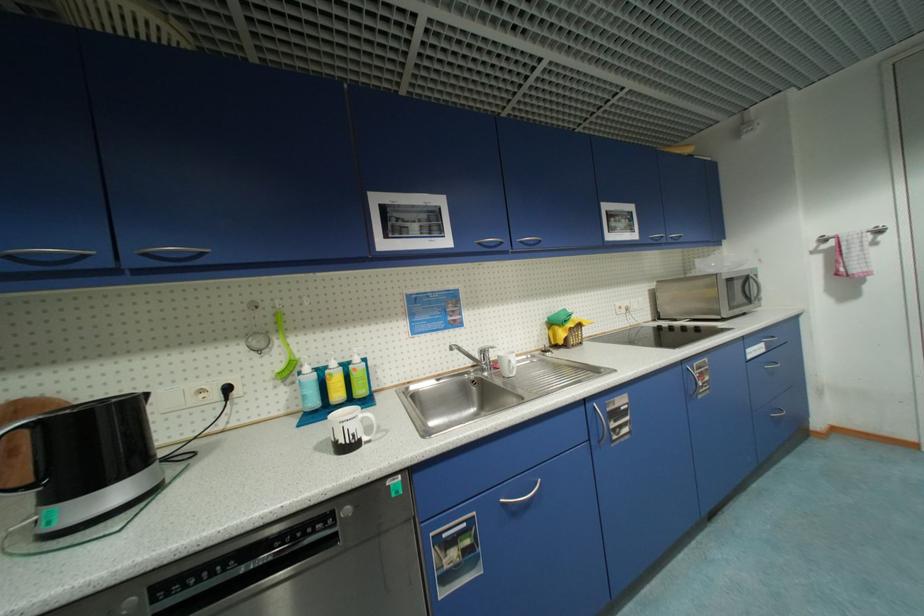
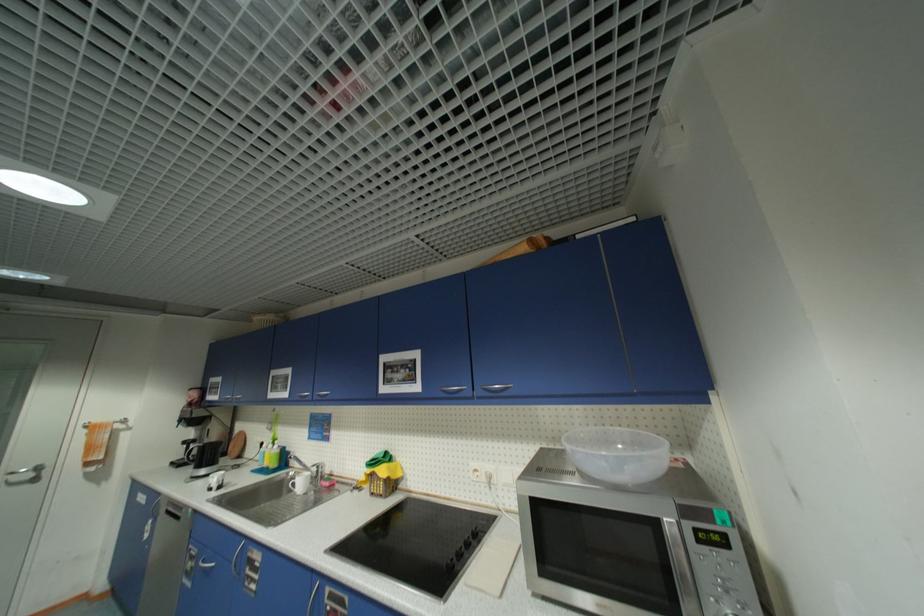
Where in the second image is the point corresponding to point (459, 554) from the first image?

(196, 565)